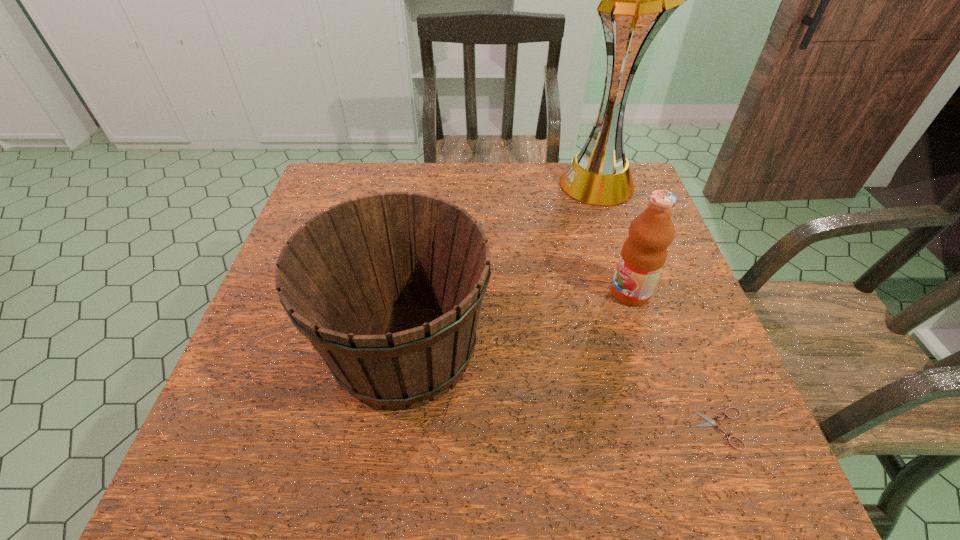
Identify the location of vacant region located on the front label of the fruit juice. The height and width of the screenshot is (540, 960). (533, 293).

Find the location of `vacant space located on the back of the wine bucket`. vacant space located on the back of the wine bucket is located at coordinates (425, 202).

This screenshot has height=540, width=960. I want to click on vacant space situated on the back of the shears, so click(x=702, y=379).

Find the location of `object at the far edge`. object at the far edge is located at coordinates (636, 0).

You are a GUI agent. You are given a task and a screenshot of the screen. Output one action in this format:
    pyautogui.click(x=<x>, y=<y>)
    Task: Click on the object situated at the near edge
    
    Given the screenshot: What is the action you would take?
    pyautogui.click(x=710, y=422)

The width and height of the screenshot is (960, 540). I want to click on object that is positioned at the left edge, so click(x=388, y=288).

Find the location of `trophy present at the right edge`. trophy present at the right edge is located at coordinates (636, 0).

Where is `fruit juice that is at the right edge`? fruit juice that is at the right edge is located at coordinates coord(644,252).

At what (x,y) coordinates should I click in order to perform the action: click on shears at the right edge. Please return your answer as a coordinate pair (x, y). Looking at the image, I should click on (710, 422).

At what (x,y) coordinates should I click in order to perform the action: click on object that is at the far right corner. Please return your answer as a coordinate pair (x, y). The height and width of the screenshot is (540, 960). Looking at the image, I should click on (636, 0).